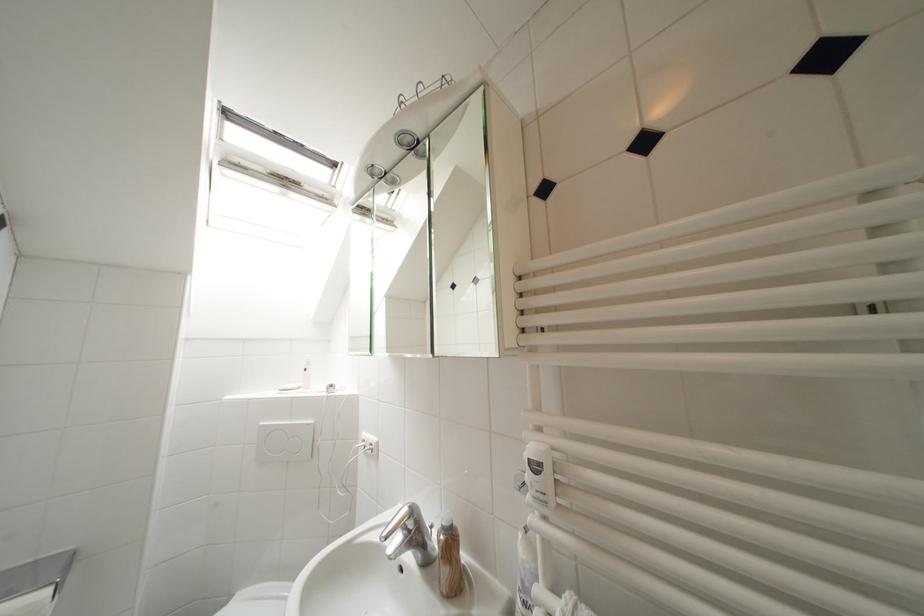
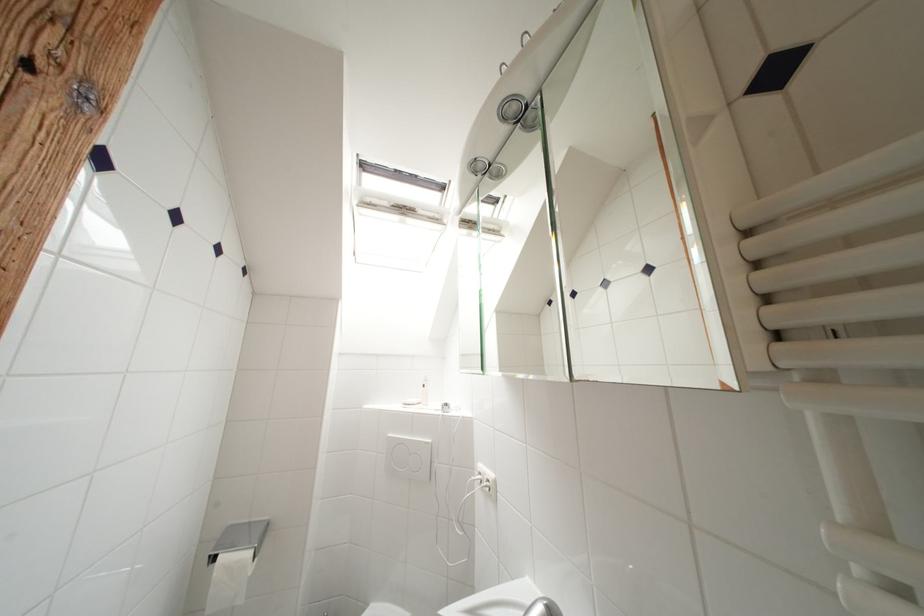
Question: How did the camera likely rotate?

Choices:
 (A) Left
 (B) Right
 (C) Up
 (D) Down

Answer: (A)